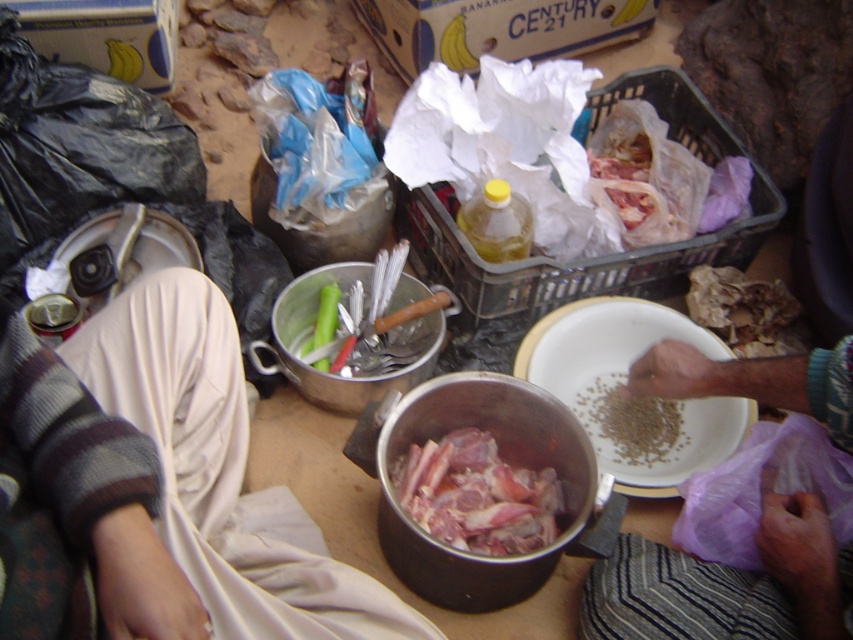
Question: Is metallic silver bowl at center positioned in front of brown matte seeds at center?

Choices:
 (A) no
 (B) yes

Answer: (B)

Question: Which point is closer to the camera?

Choices:
 (A) white matte bowl at center
 (B) brown matte seeds at center

Answer: (A)

Question: Is white matte bowl at center wider than brown matte seeds at center?

Choices:
 (A) no
 (B) yes

Answer: (B)

Question: Is pinkish raw meat at center below brown matte seeds at center?

Choices:
 (A) no
 (B) yes

Answer: (B)

Question: Among these points, which one is nearest to the camera?

Choices:
 (A) (744, 586)
 (B) (315, 268)

Answer: (A)

Question: Which of the following is the farthest from the observer?

Choices:
 (A) (585, 515)
 (B) (277, 368)
 (C) (625, 444)

Answer: (C)